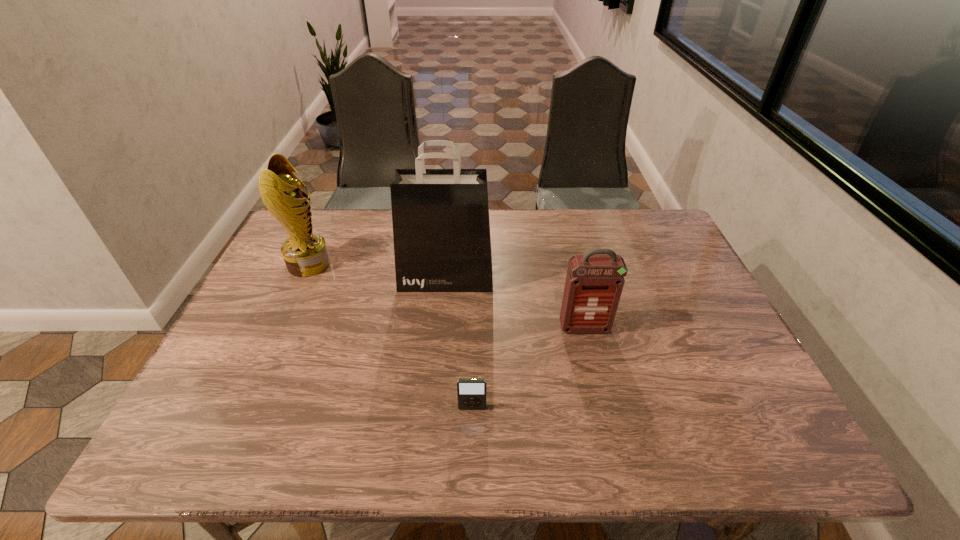
Locate an element on the screen. This screenshot has height=540, width=960. vacant space in between the tallest object and the nearest object is located at coordinates (459, 343).

The width and height of the screenshot is (960, 540). I want to click on free spot between the iPod and the shopping bag, so [459, 343].

Identify the location of vacant space in between the shortest object and the tallest object. (459, 343).

Find the location of a particular element. free space that is in between the nearest object and the award is located at coordinates (391, 336).

Where is `unoccupied area between the third shortest object and the iPod`? The width and height of the screenshot is (960, 540). unoccupied area between the third shortest object and the iPod is located at coordinates (391, 336).

I want to click on blank region between the leftmost object and the shopping bag, so [377, 271].

Where is `unoccupied area between the iPod and the leftmost object`? Image resolution: width=960 pixels, height=540 pixels. unoccupied area between the iPod and the leftmost object is located at coordinates (391, 336).

This screenshot has width=960, height=540. Identify the location of vacant space in between the award and the nearest object. (391, 336).

Identify the location of blank region between the leftmost object and the shopping bag. (377, 271).

Locate which object is the second closest to the tallest object. Please provide its 2D coordinates. Your answer should be formatted as a tuple, i.e. [(x, y)], where the tuple contains the x and y coordinates of a point satisfying the conditions above.

[(305, 253)]